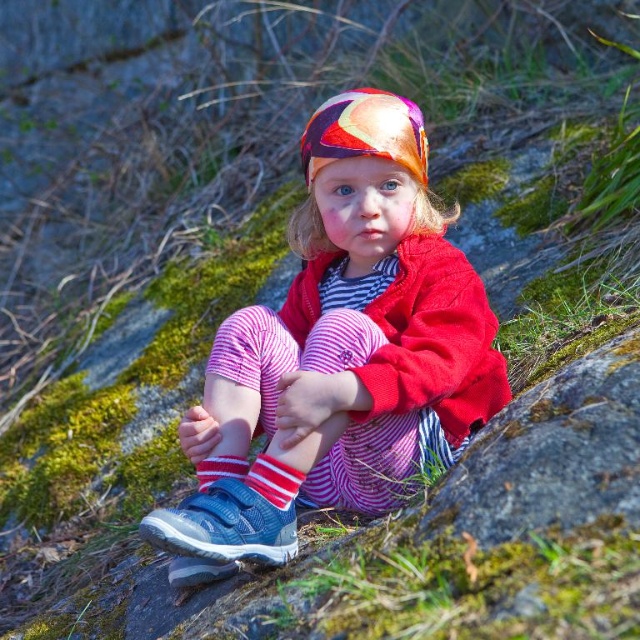
Question: Can you confirm if striped cotton sock at lower center is smaller than striped cotton sock at center?

Choices:
 (A) yes
 (B) no

Answer: (B)

Question: Does striped cotton sock at lower center lie behind striped cotton sock at center?

Choices:
 (A) no
 (B) yes

Answer: (A)

Question: Which object is positioned farthest from the striped cotton sock at lower center?

Choices:
 (A) striped cotton pants at center
 (B) striped cotton sock at center

Answer: (A)

Question: From the image, what is the correct spatial relationship of striped cotton pants at center in relation to striped cotton sock at lower center?

Choices:
 (A) below
 (B) above

Answer: (B)

Question: Which object appears farthest from the camera in this image?

Choices:
 (A) striped cotton sock at lower center
 (B) striped cotton sock at center

Answer: (B)

Question: Which of the following is the closest to the observer?

Choices:
 (A) striped cotton sock at lower center
 (B) striped cotton sock at center

Answer: (A)